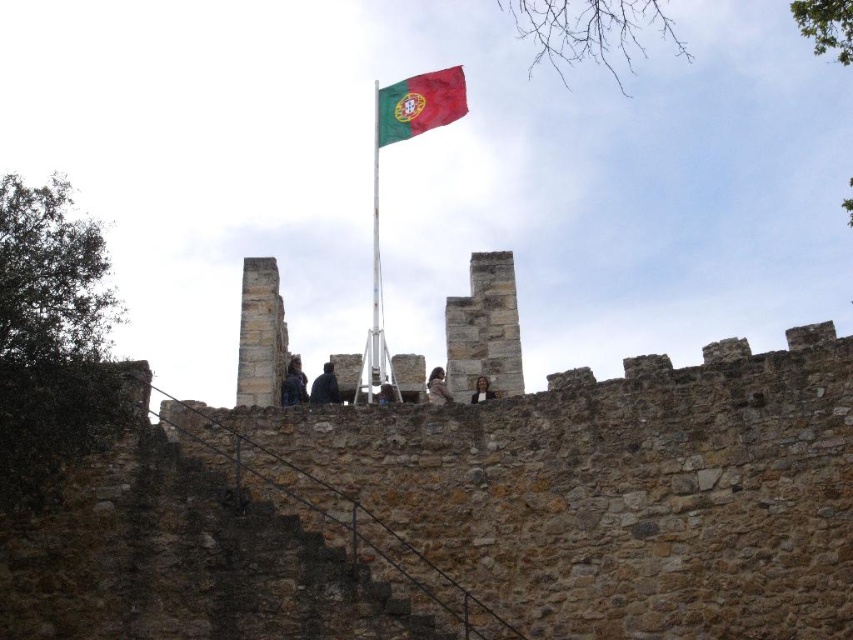
In the scene shown: Which is more to the right, brown stone wall at upper center or dark blue denim jacket at upper center?

Positioned to the right is brown stone wall at upper center.

Can you confirm if brown stone wall at upper center is positioned to the right of dark blue denim jacket at upper center?

Yes, brown stone wall at upper center is to the right of dark blue denim jacket at upper center.

Is point (579, 602) in front of point (291, 380)?

That is True.

Locate an element on the screen. brown stone wall at upper center is located at coordinates (451, 500).

Does green and red fabric flag at upper center appear under light brown leather jacket at center?

No.

Identify the location of green and red fabric flag at upper center. This screenshot has height=640, width=853. (419, 104).

Between point (453, 65) and point (479, 378), which one is positioned in front?

Point (479, 378) is more forward.

Image resolution: width=853 pixels, height=640 pixels. I want to click on green and red fabric flag at upper center, so click(x=419, y=104).

Is point (374, 195) positioned in front of point (376, 394)?

No, (374, 195) is further to viewer.

Can you confirm if silver metallic flag pole at center is positioned to the left of dark gray stone person at center?

Yes, silver metallic flag pole at center is to the left of dark gray stone person at center.

Image resolution: width=853 pixels, height=640 pixels. I want to click on silver metallic flag pole at center, so click(x=375, y=266).

I want to click on silver metallic flag pole at center, so click(x=375, y=266).